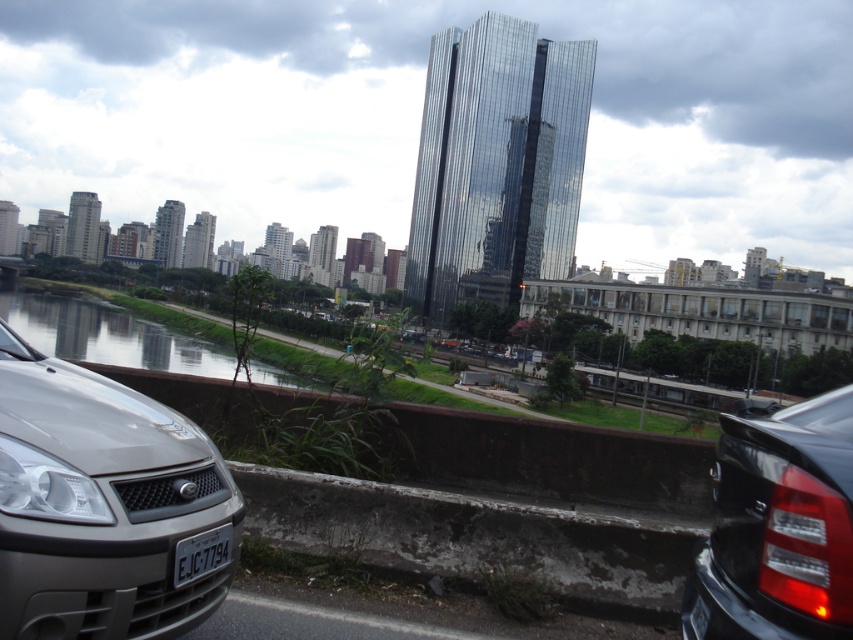
Who is taller, satin silver car at lower left or black glossy car at right?

black glossy car at right is taller.

Measure the distance from satin silver car at lower left to black glossy car at right.

A distance of 7.51 feet exists between satin silver car at lower left and black glossy car at right.

This screenshot has height=640, width=853. Identify the location of satin silver car at lower left. (105, 506).

Which is above, black glossy car at right or white plastic license plate at lower center?

white plastic license plate at lower center

Is black glossy car at right to the right of white plastic license plate at lower center from the viewer's perspective?

Correct, you'll find black glossy car at right to the right of white plastic license plate at lower center.

Is point (764, 557) farther from viewer compared to point (177, 544)?

No.

Identify the location of black glossy car at right. The height and width of the screenshot is (640, 853). (778, 528).

Who is positioned more to the right, satin silver car at lower left or white plastic license plate at lower center?

From the viewer's perspective, white plastic license plate at lower center appears more on the right side.

Does satin silver car at lower left have a larger size compared to white plastic license plate at lower center?

Yes.

The height and width of the screenshot is (640, 853). What are the coordinates of `satin silver car at lower left` in the screenshot? It's located at (105, 506).